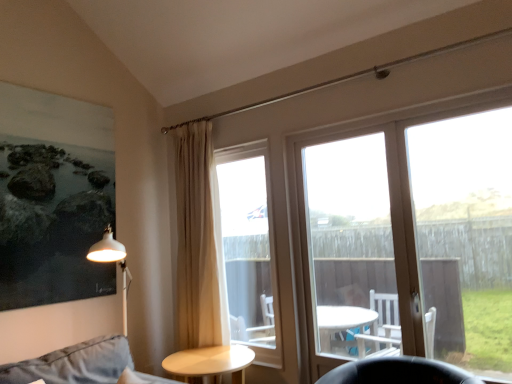
I want to click on vacant space situated above clear glass door at center right (from a real-world perspective), so (440, 115).